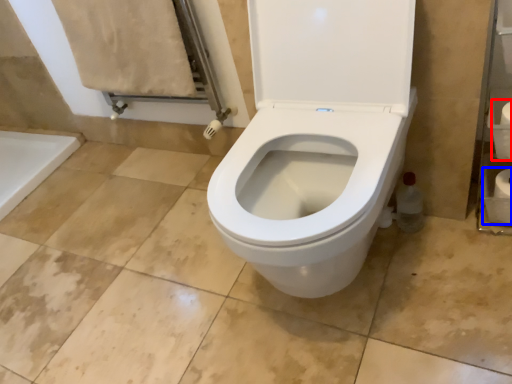
Question: Which point is further to the camera, toilet paper (highlighted by a red box) or toilet paper (highlighted by a blue box)?

Choices:
 (A) toilet paper
 (B) toilet paper

Answer: (B)